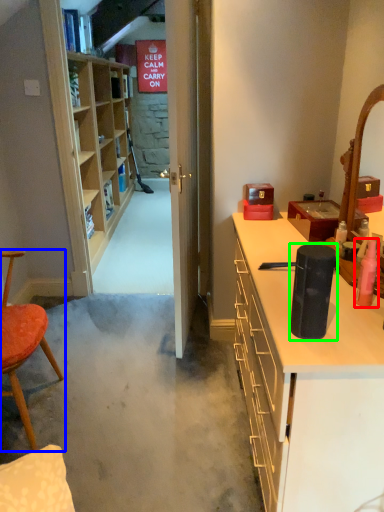
Question: Based on their relative distances, which object is nearer to toiletry (highlighted by a red box)? Choose from chair (highlighted by a blue box) and appliance (highlighted by a green box).

Choices:
 (A) chair
 (B) appliance

Answer: (B)